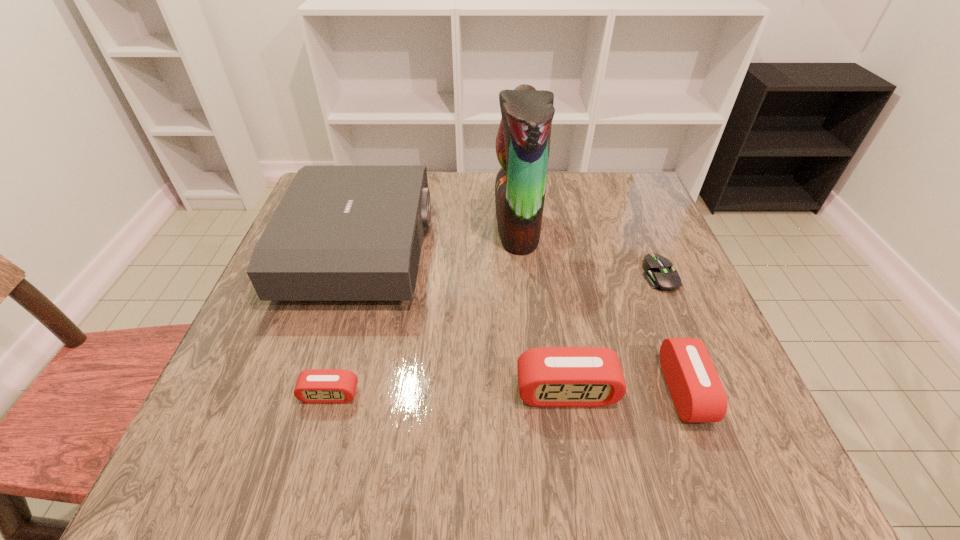
Locate an element on the screen. This screenshot has width=960, height=540. the leftmost alarm clock is located at coordinates (315, 385).

You are a GUI agent. You are given a task and a screenshot of the screen. Output one action in this format:
    pyautogui.click(x=<x>, y=<y>)
    Task: Click on the shortest alarm clock
    The height and width of the screenshot is (540, 960).
    Given the screenshot: What is the action you would take?
    pyautogui.click(x=315, y=385)

This screenshot has height=540, width=960. In order to click on the second alarm clock from right to left in this screenshot , I will do `click(547, 376)`.

Identify the location of the second tallest alarm clock. The image size is (960, 540). (697, 392).

Where is `the rightmost alarm clock`? The width and height of the screenshot is (960, 540). the rightmost alarm clock is located at coordinates (697, 392).

Locate an element on the screen. parrot is located at coordinates (523, 140).

Where is `projector`? projector is located at coordinates point(340,233).

Image resolution: width=960 pixels, height=540 pixels. In order to click on the shortest object in this screenshot , I will do `click(659, 274)`.

Locate an element on the screen. vacant space situated 0.070m on the front-facing side of the second tallest alarm clock is located at coordinates (741, 390).

At what (x,y) coordinates should I click in order to perform the action: click on free space located at the face of the parrot. Please return your answer as a coordinate pair (x, y). The height and width of the screenshot is (540, 960). Looking at the image, I should click on (463, 225).